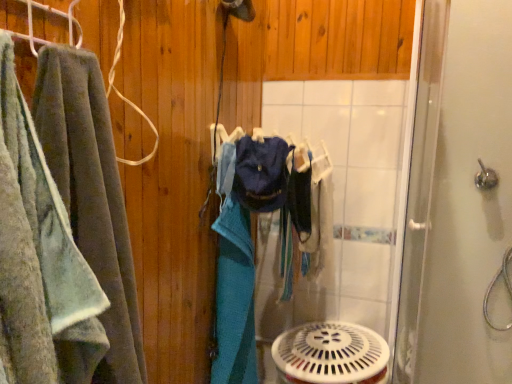
Question: From the image's perspective, is white plastic mechanical fan at lower center on silver metallic shower handle at upper right?

Choices:
 (A) no
 (B) yes

Answer: (A)

Question: Is white plastic mechanical fan at lower center far away from silver metallic shower handle at upper right?

Choices:
 (A) yes
 (B) no

Answer: (B)

Question: Can we say white plastic mechanical fan at lower center lies outside silver metallic shower handle at upper right?

Choices:
 (A) yes
 (B) no

Answer: (A)

Question: From the image's perspective, is white plastic mechanical fan at lower center beneath silver metallic shower handle at upper right?

Choices:
 (A) no
 (B) yes

Answer: (B)

Question: Does white plastic mechanical fan at lower center have a lesser width compared to silver metallic shower handle at upper right?

Choices:
 (A) yes
 (B) no

Answer: (B)

Question: Considering the relative positions of white plastic mechanical fan at lower center and silver metallic shower handle at upper right in the image provided, is white plastic mechanical fan at lower center in front of silver metallic shower handle at upper right?

Choices:
 (A) no
 (B) yes

Answer: (B)

Question: From the image's perspective, would you say soft green towel at left is shown under silver metallic shower handle at upper right?

Choices:
 (A) no
 (B) yes

Answer: (B)

Question: Is soft green towel at left aimed at silver metallic shower handle at upper right?

Choices:
 (A) yes
 (B) no

Answer: (B)

Question: From a real-world perspective, does soft green towel at left sit lower than silver metallic shower handle at upper right?

Choices:
 (A) yes
 (B) no

Answer: (A)

Question: Does soft green towel at left have a greater width compared to silver metallic shower handle at upper right?

Choices:
 (A) no
 (B) yes

Answer: (B)

Question: Would you say soft green towel at left is a long distance from silver metallic shower handle at upper right?

Choices:
 (A) no
 (B) yes

Answer: (B)

Question: Is soft green towel at left positioned with its back to silver metallic shower handle at upper right?

Choices:
 (A) no
 (B) yes

Answer: (A)

Question: Is the surface of white plastic mechanical fan at lower center in direct contact with clear glass shower door at right?

Choices:
 (A) yes
 (B) no

Answer: (B)